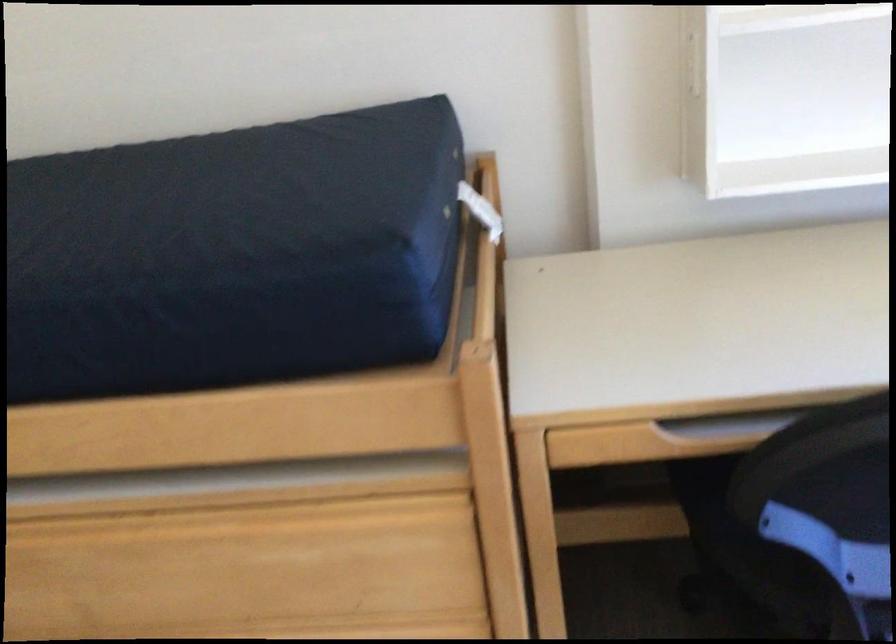
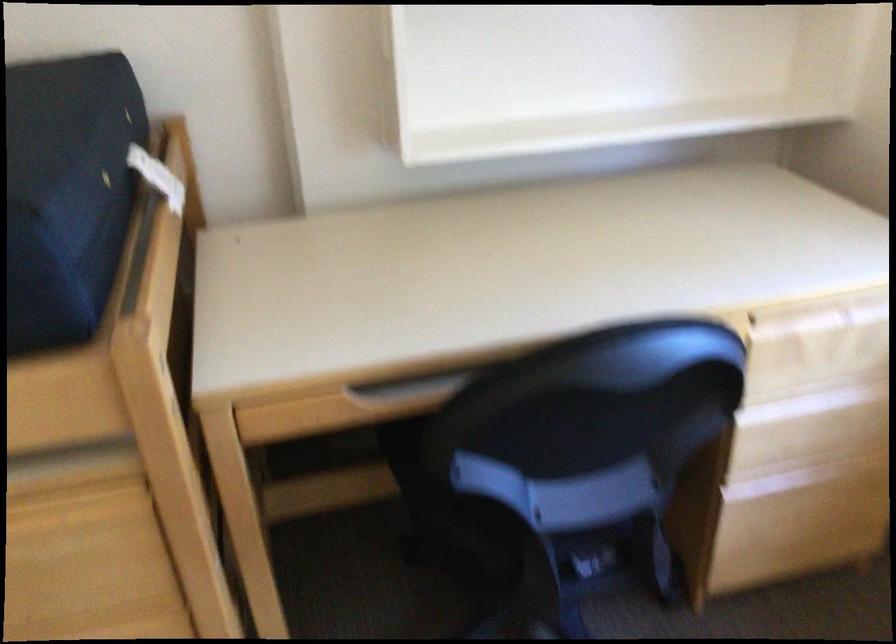
Question: The camera is either moving clockwise (left) or counter-clockwise (right) around the object. The first image is from the beginning of the video and the second image is from the end. Is the camera moving left or right when shooting the video?

Choices:
 (A) Left
 (B) Right

Answer: (A)